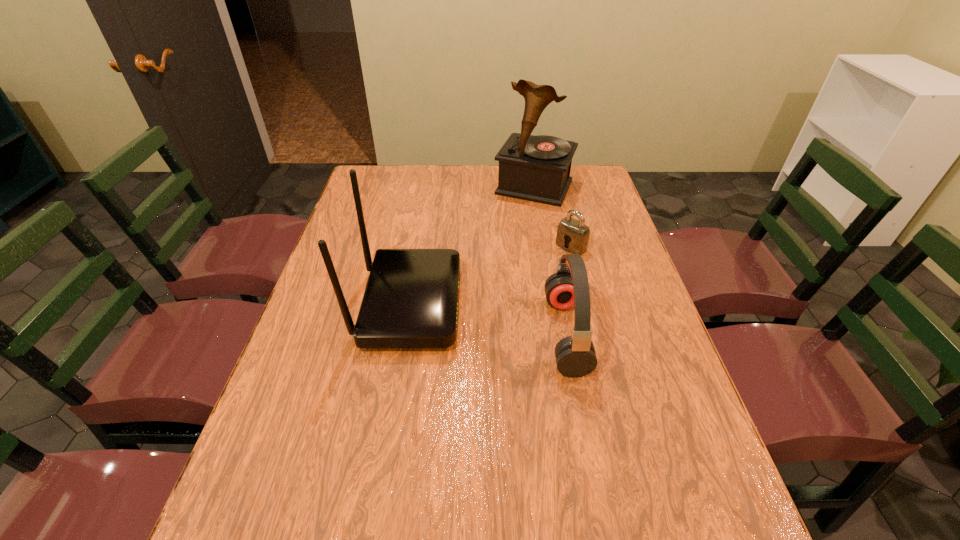
At what (x,y) coordinates should I click in order to perform the action: click on free space on the desktop that is between the router and the earphone and is positioned at the front of the third nearest object near the keyhole. Please return your answer as a coordinate pair (x, y). Image resolution: width=960 pixels, height=540 pixels. Looking at the image, I should click on point(476,317).

Image resolution: width=960 pixels, height=540 pixels. I want to click on free space on the desktop that is between the router and the third tallest object and is positioned at the horn opening of the farthest object, so click(468, 315).